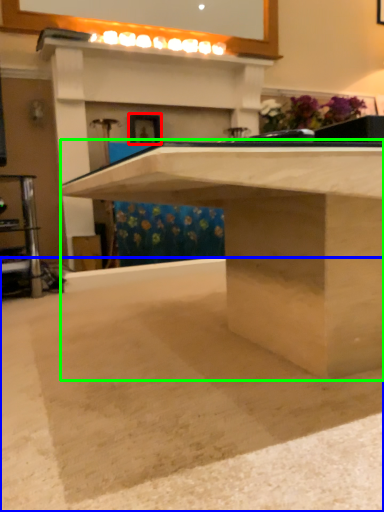
Question: Based on their relative distances, which object is farther from picture frame (highlighted by a red box)? Choose from concrete (highlighted by a blue box) and table (highlighted by a green box).

Choices:
 (A) concrete
 (B) table

Answer: (A)